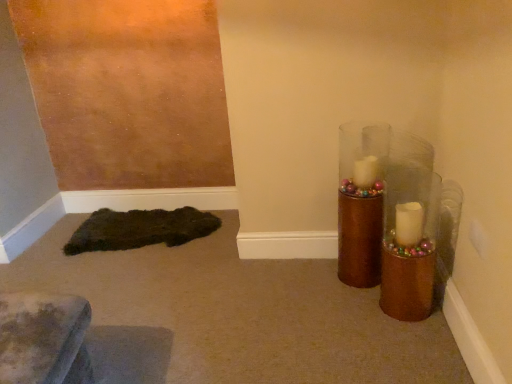
Question: From the image's perspective, is dark brown fuzzy rug at lower left located beneath gold metallic candle holder at right?

Choices:
 (A) yes
 (B) no

Answer: (A)

Question: Is dark brown fuzzy rug at lower left oriented towards gold metallic candle holder at right?

Choices:
 (A) yes
 (B) no

Answer: (B)

Question: Would you say dark brown fuzzy rug at lower left is outside gold metallic candle holder at right?

Choices:
 (A) no
 (B) yes

Answer: (B)

Question: Can gold metallic candle holder at right be found inside dark brown fuzzy rug at lower left?

Choices:
 (A) yes
 (B) no

Answer: (B)

Question: Does dark brown fuzzy rug at lower left have a lesser height compared to gold metallic candle holder at right?

Choices:
 (A) no
 (B) yes

Answer: (B)

Question: Considering the relative sizes of dark brown fuzzy rug at lower left and gold metallic candle holder at right in the image provided, is dark brown fuzzy rug at lower left smaller than gold metallic candle holder at right?

Choices:
 (A) yes
 (B) no

Answer: (A)

Question: Can you confirm if gold metallic candle holder at right is smaller than dark brown fuzzy rug at lower left?

Choices:
 (A) no
 (B) yes

Answer: (A)

Question: From the image's perspective, is gold metallic candle holder at right located beneath dark brown fuzzy rug at lower left?

Choices:
 (A) no
 (B) yes

Answer: (A)

Question: Could dark brown fuzzy rug at lower left be considered to be inside gold metallic candle holder at right?

Choices:
 (A) no
 (B) yes

Answer: (A)

Question: Is gold metallic candle holder at right beside dark brown fuzzy rug at lower left?

Choices:
 (A) yes
 (B) no

Answer: (B)

Question: Does gold metallic candle holder at right appear on the left side of dark brown fuzzy rug at lower left?

Choices:
 (A) yes
 (B) no

Answer: (B)

Question: Is gold metallic candle holder at right at the right side of dark brown fuzzy rug at lower left?

Choices:
 (A) yes
 (B) no

Answer: (A)

Question: Is dark brown fuzzy rug at lower left in front of or behind gold metallic candle holder at right in the image?

Choices:
 (A) behind
 (B) front

Answer: (A)